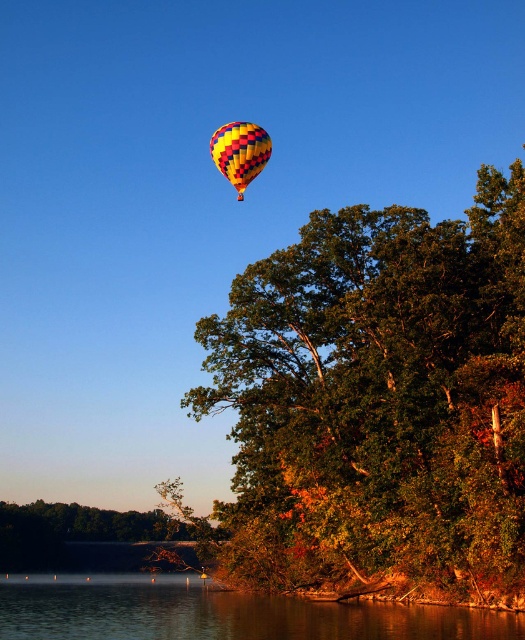
You are an observer looking at the scene. You notice the green leafy tree at upper center and the yellow and red checkered fabric balloon at upper center. Which object appears wider in the image?

The green leafy tree at upper center appears wider than the yellow and red checkered fabric balloon at upper center because its width is larger according to the description.

You are a bird soaring in the sky and see the green leafy tree at upper center and the smooth water at lower center. Which object is higher in the scene?

The green leafy tree at upper center is higher than the smooth water at lower center.